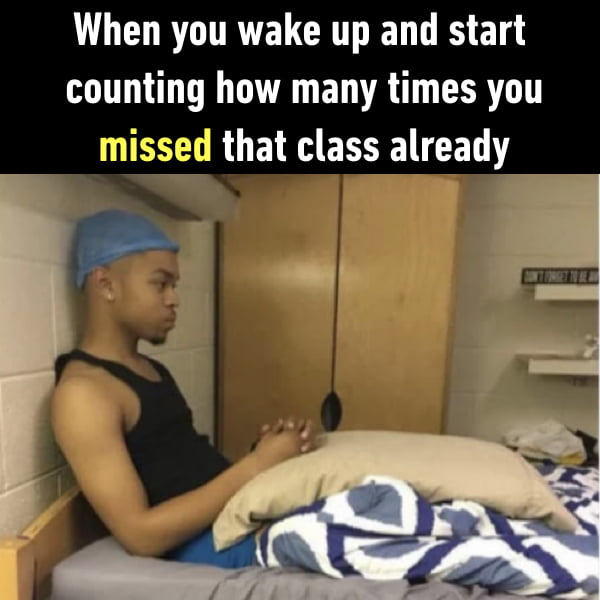
This screenshot has width=600, height=600. Find the location of `gray sheet`. gray sheet is located at coordinates (350, 590).